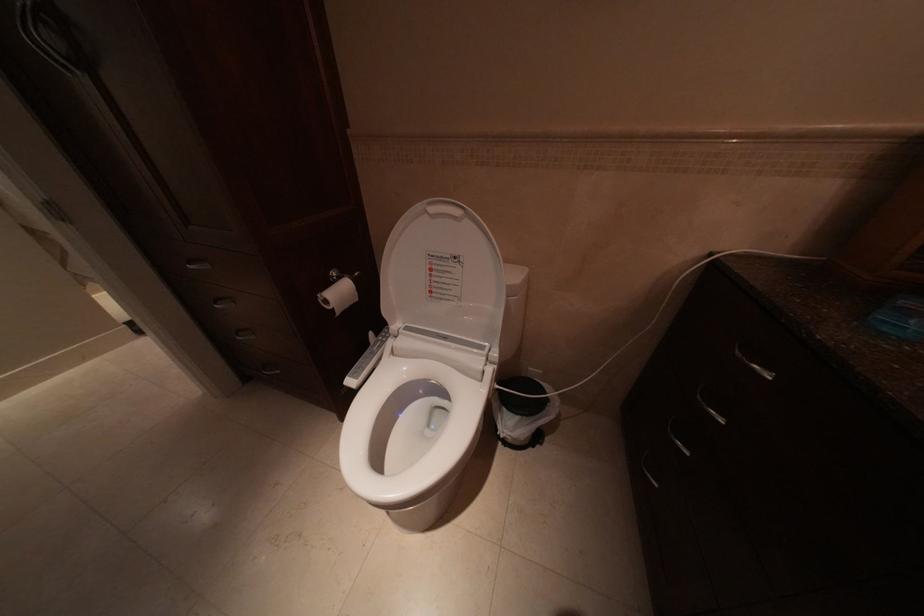
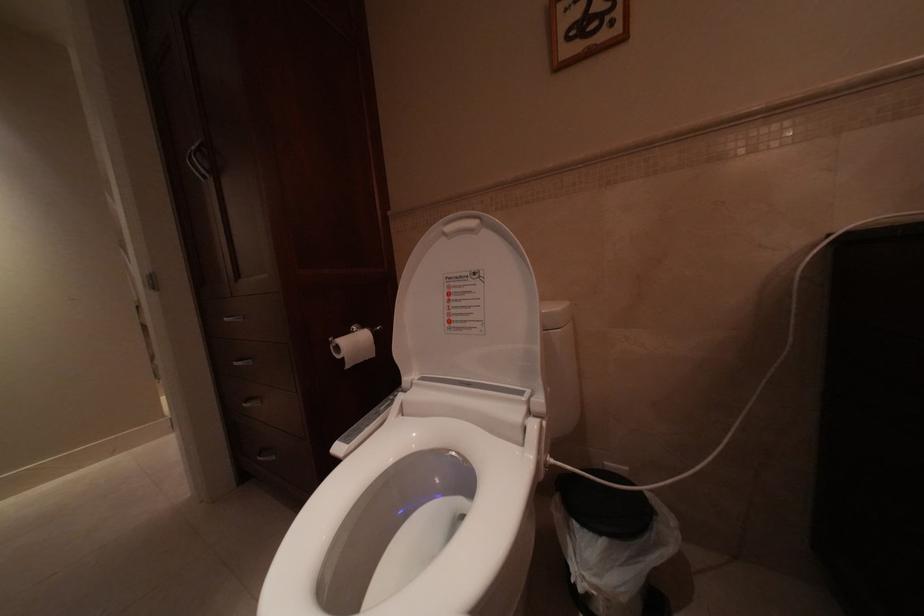
Question: Based on the continuous images, in which direction is the camera rotating? Reply with the corresponding letter.

Choices:
 (A) Left
 (B) Right
 (C) Up
 (D) Down

Answer: (C)